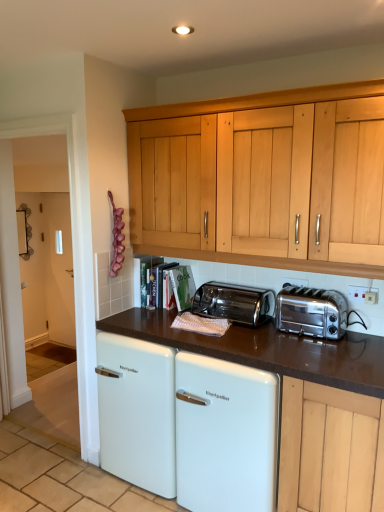
Locate an element on the screen. The image size is (384, 512). free spot in front of satin chrome toaster at right, acting as the second toaster starting from the left is located at coordinates (324, 355).